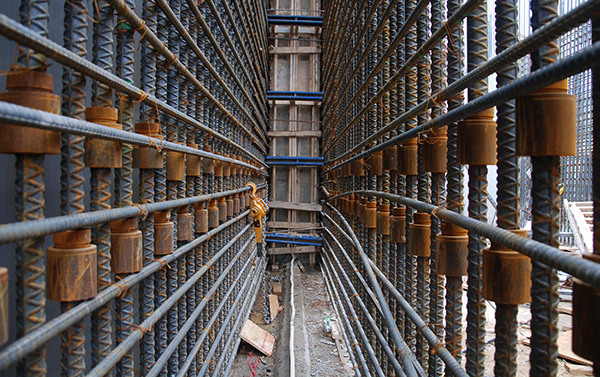
Where is `wood boards`? The image size is (600, 377). wood boards is located at coordinates (299, 203), (298, 224), (295, 252), (296, 133), (300, 49).